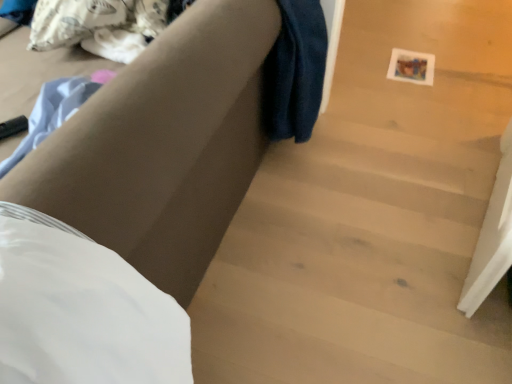
Question: Would you say wooden stairs at center is inside or outside matte brown couch at center?

Choices:
 (A) outside
 (B) inside

Answer: (A)

Question: Looking at the image, does wooden stairs at center seem bigger or smaller compared to matte brown couch at center?

Choices:
 (A) small
 (B) big

Answer: (A)

Question: Estimate the real-world distances between objects in this image. Which object is farther from the wooden stairs at center?

Choices:
 (A) white matte sheet at lower left
 (B) matte brown couch at center

Answer: (A)

Question: Based on their relative distances, which object is farther from the white matte sheet at lower left?

Choices:
 (A) matte brown couch at center
 (B) wooden stairs at center

Answer: (B)